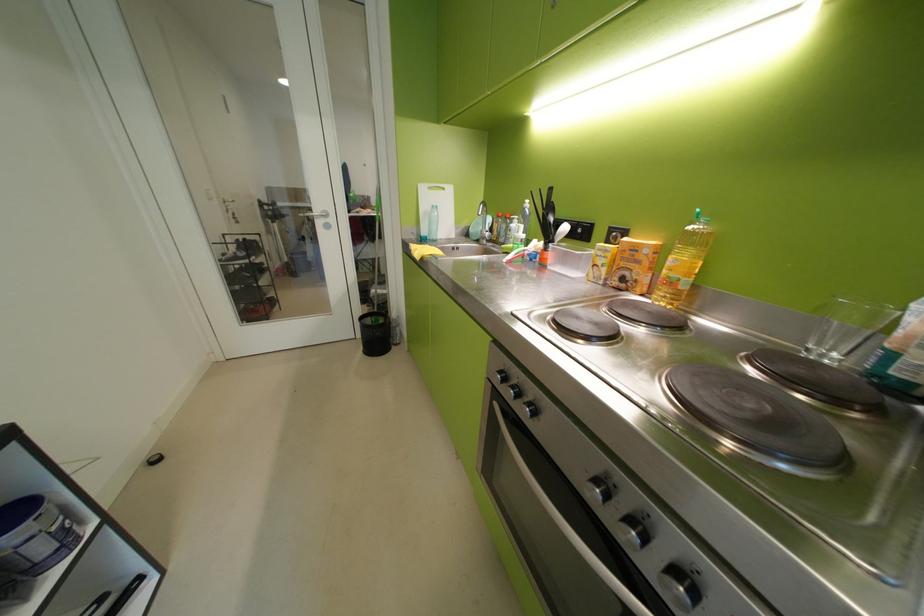
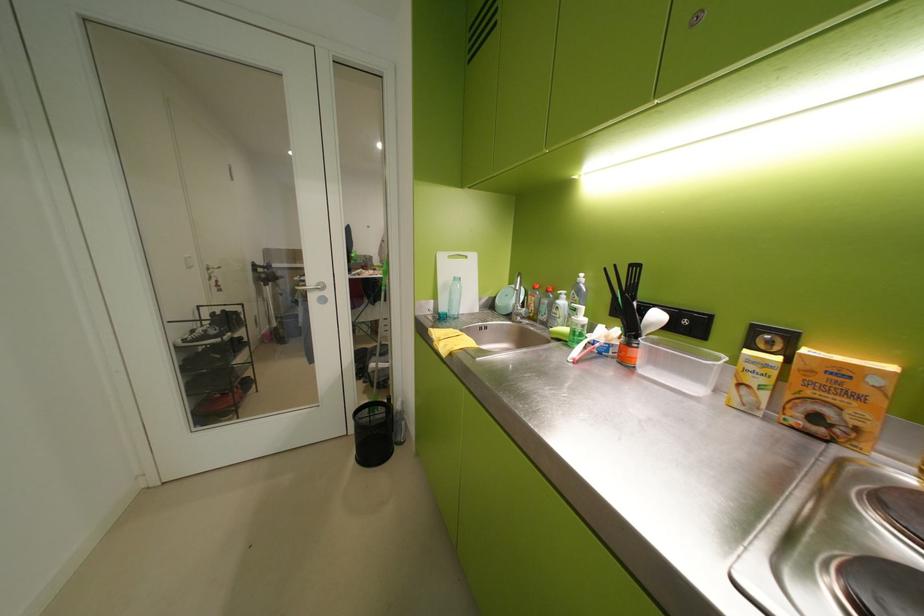
Locate, in the second image, the point that corresponds to (622,232) in the first image.

(767, 331)